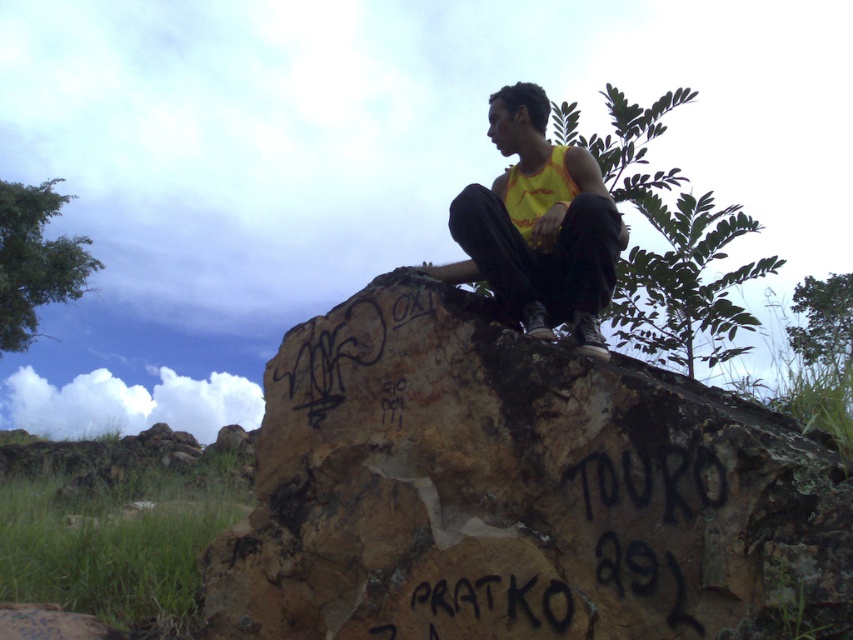
Which of these two, brown rough rock at upper center or yellow fabric tank top at center, stands taller?

brown rough rock at upper center

Does brown rough rock at upper center have a lesser width compared to yellow fabric tank top at center?

No.

Is point (592, 380) in front of point (577, 224)?

Yes, point (592, 380) is in front of point (577, 224).

Locate an element on the screen. brown rough rock at upper center is located at coordinates (518, 492).